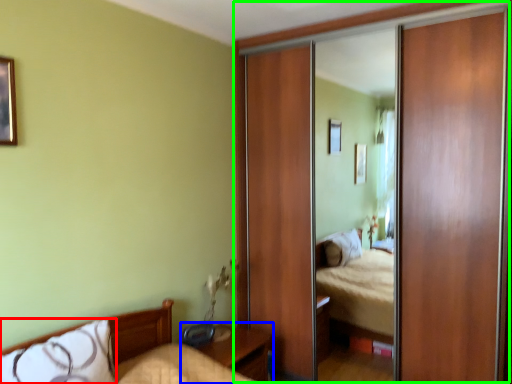
Question: Which object is positioned farthest from pillow (highlighted by a red box)? Select from nightstand (highlighted by a blue box) and glass door (highlighted by a green box).

Choices:
 (A) nightstand
 (B) glass door

Answer: (B)